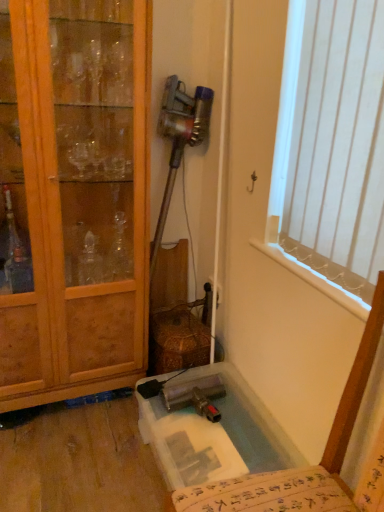
Locate an element on the screen. free space above clear plastic bath at lower center (from a real-world perspective) is located at coordinates coord(220,431).